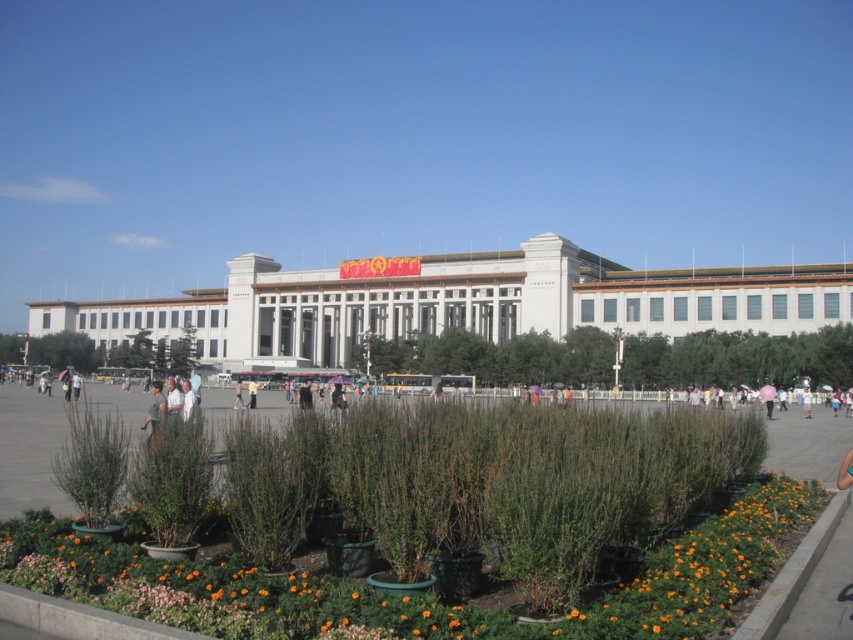
Question: Does orange matte flowers at lower right appear over light brown fabric jacket at center?

Choices:
 (A) yes
 (B) no

Answer: (A)

Question: Which of the following is the closest to the observer?

Choices:
 (A) (755, 616)
 (B) (236, 394)

Answer: (A)

Question: Is orange matte flowers at lower right wider than green leafy bush at center?

Choices:
 (A) no
 (B) yes

Answer: (A)

Question: Estimate the real-world distances between objects in this image. Which object is farther from the light brown fabric jacket at center?

Choices:
 (A) green leafy bush at center
 (B) green plastic planters at center

Answer: (A)

Question: Is orange matte flowers at lower right wider than gray fabric person at center?

Choices:
 (A) yes
 (B) no

Answer: (B)

Question: Which of the following is the farthest from the observer?

Choices:
 (A) light brown leather jacket at center
 (B) gray fabric person at center
 (C) green plastic planters at center

Answer: (A)